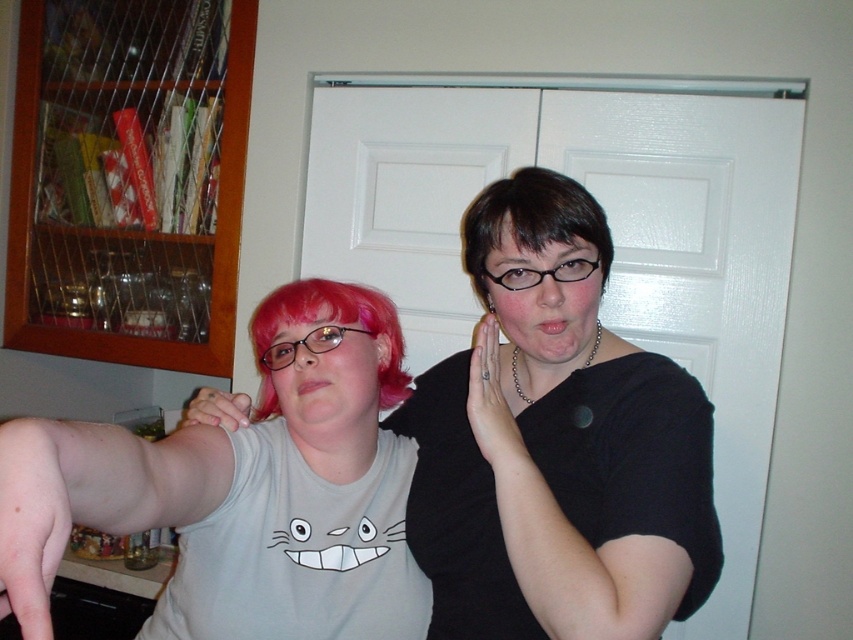
You are standing in front of the photo and want to determine which of the two points, point (387, 356) or point (207, 477), is closer to you. Based on the image, which point is nearer?

Point (387, 356) is further to the viewer than point (207, 477), so the closer point to you is point (207, 477).

You are a photographer trying to capture a clear shot of both the light gray cotton tank top at center and the pink synthetic wig at center. Since you want both items to be in focus, you need to adjust your camera settings. Which object should you focus on to ensure both are sharp?

The light gray cotton tank top at center is much taller than the pink synthetic wig at center, so focusing on the light gray cotton tank top at center will ensure both are in focus because it is the farther object.